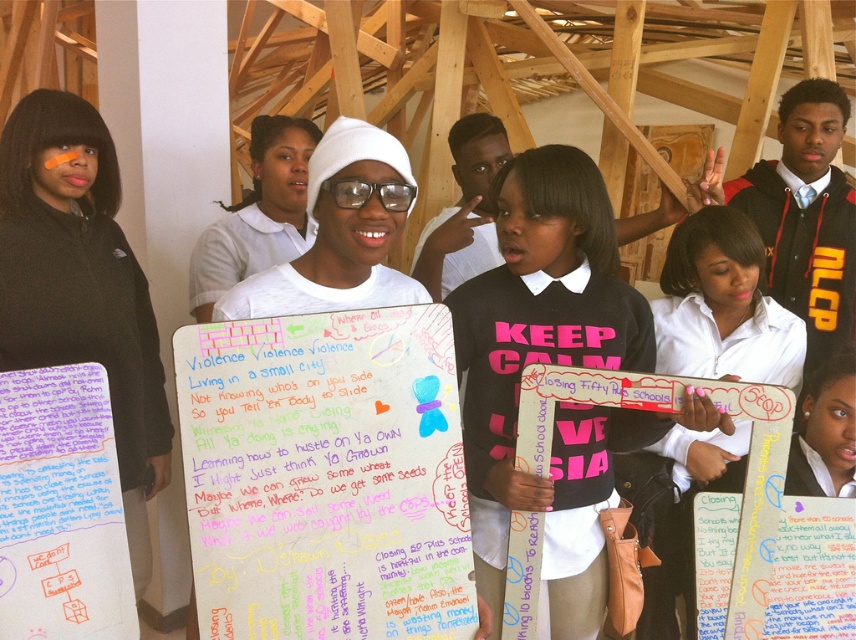
Question: Which of the following is the farthest from the observer?

Choices:
 (A) white matte shirt at center
 (B) colored paper poster at center
 (C) handwritten paper at center
 (D) white matte signboard at center

Answer: (A)

Question: Among these points, which one is farthest from the camera?

Choices:
 (A) (299, 214)
 (B) (836, 636)
 (C) (679, 486)

Answer: (A)

Question: Estimate the real-world distances between objects in this image. Which object is farther from the clear plastic goggles at center?

Choices:
 (A) colored paper poster at center
 (B) black matte shirt at center
 (C) handwritten paper at center

Answer: (A)

Question: Does black matte shirt at center appear on the left side of handwritten paper at center?

Choices:
 (A) no
 (B) yes

Answer: (A)

Question: Is white matte shirt at center to the right of colored paper poster at center from the viewer's perspective?

Choices:
 (A) no
 (B) yes

Answer: (A)

Question: Does handwritten paper at center have a smaller size compared to colored paper poster at center?

Choices:
 (A) no
 (B) yes

Answer: (B)